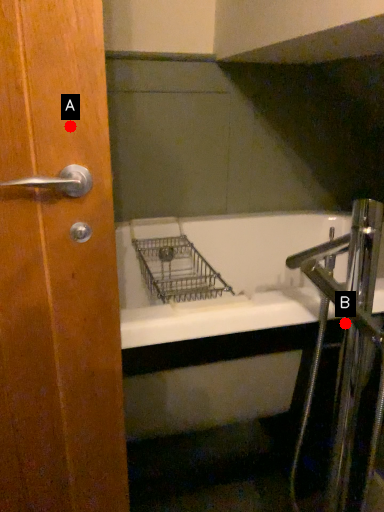
Question: Two points are circled on the image, labeled by A and B beside each circle. Among these points, which one is farthest from the camera?

Choices:
 (A) A is further
 (B) B is further

Answer: (B)